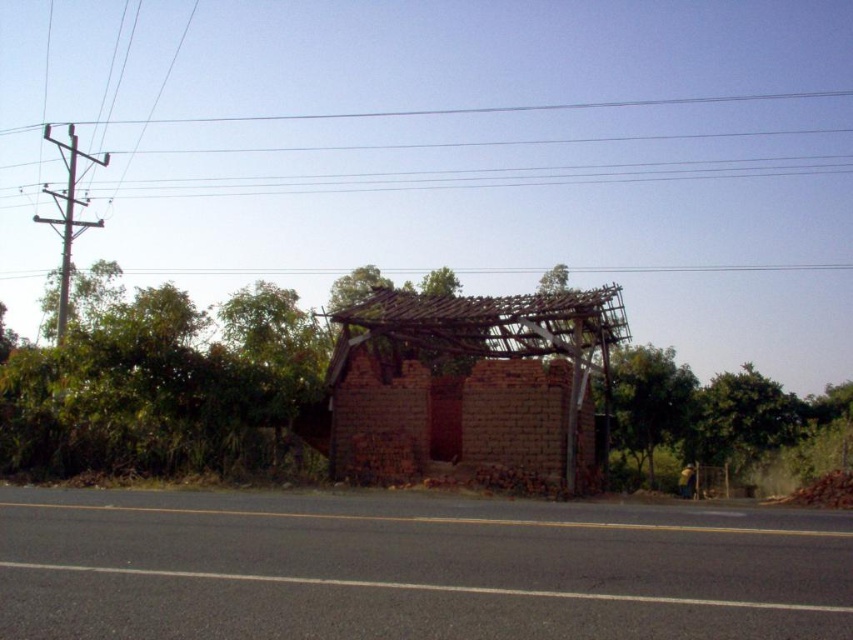
In the scene shown: Can you confirm if green leafy tree at center is bigger than brown wooden telegraph pole at left?

No, green leafy tree at center is not bigger than brown wooden telegraph pole at left.

Which of these two, green leafy tree at center or brown wooden telegraph pole at left, stands shorter?

green leafy tree at center is shorter.

This screenshot has height=640, width=853. What do you see at coordinates (717, 417) in the screenshot?
I see `green leafy tree at center` at bounding box center [717, 417].

Find the location of a particular element. Image resolution: width=853 pixels, height=640 pixels. green leafy tree at center is located at coordinates (717, 417).

Who is higher up, red brick hut at center or green leafy tree at right?

red brick hut at center

Who is shorter, red brick hut at center or green leafy tree at right?

green leafy tree at right is shorter.

Where is `red brick hut at center`? red brick hut at center is located at coordinates (469, 388).

Can you confirm if red brick hut at center is smaller than brown wooden telegraph pole at left?

Yes.

Consider the image. Is red brick hut at center below brown wooden telegraph pole at left?

Correct, red brick hut at center is located below brown wooden telegraph pole at left.

Image resolution: width=853 pixels, height=640 pixels. Find the location of `red brick hut at center`. red brick hut at center is located at coordinates (469, 388).

Where is `red brick hut at center`? This screenshot has width=853, height=640. red brick hut at center is located at coordinates (469, 388).